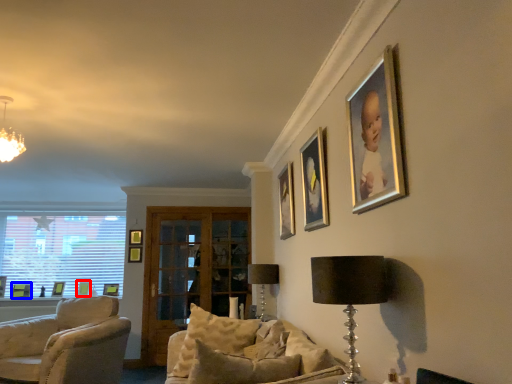
Question: Which object is further to the camera taking this photo, picture frame (highlighted by a red box) or picture frame (highlighted by a blue box)?

Choices:
 (A) picture frame
 (B) picture frame

Answer: (A)